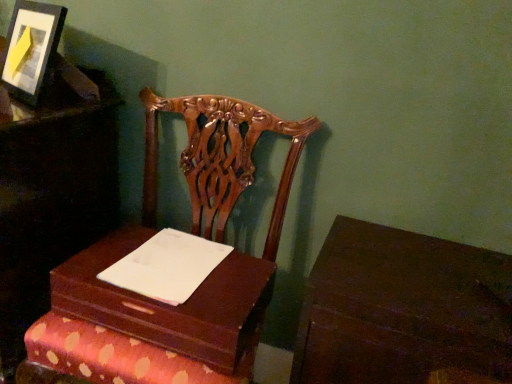
Question: Considering the positions of wooden box at center and dark wood table at lower right in the image, is wooden box at center taller or shorter than dark wood table at lower right?

Choices:
 (A) short
 (B) tall

Answer: (A)

Question: Is wooden box at center wider or thinner than dark wood table at lower right?

Choices:
 (A) thin
 (B) wide

Answer: (A)

Question: Which object is the farthest from the white paper at center?

Choices:
 (A) matte black picture frame at upper left
 (B) dark wood table at lower right
 (C) mahogany wood chair at center, the 1th furniture positioned from the right
 (D) wooden box at center
 (E) wooden chair at left, marked as the 2th furniture in a right-to-left arrangement

Answer: (A)

Question: Which is nearer to the mahogany wood chair at center, the 2th furniture viewed from the left?

Choices:
 (A) wooden chair at left, which is the first furniture in left-to-right order
 (B) wooden box at center
 (C) white paper at center
 (D) dark wood table at lower right
 (E) matte black picture frame at upper left

Answer: (B)